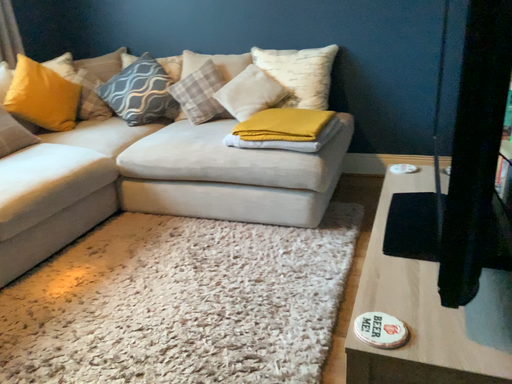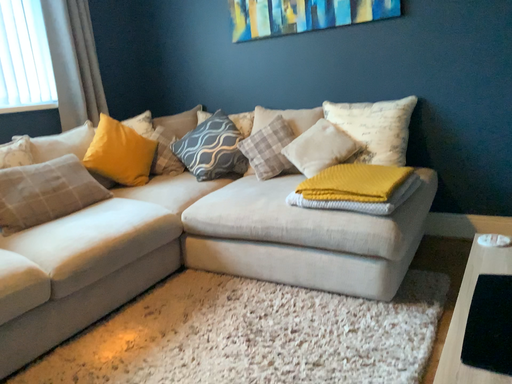
Question: Which way did the camera rotate in the video?

Choices:
 (A) rotated downward
 (B) rotated upward

Answer: (B)